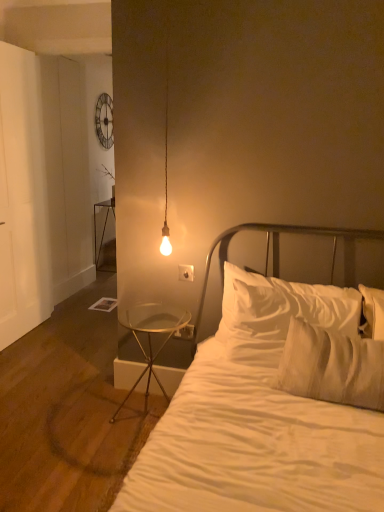
Question: Is the position of clear glass table at lower left, which ranks as the second nightstand in back-to-front order, more distant than that of white soft pillow at center?

Choices:
 (A) yes
 (B) no

Answer: (A)

Question: From the image's perspective, is clear glass table at lower left, positioned as the 1th nightstand in right-to-left order, located beneath white soft pillow at center?

Choices:
 (A) no
 (B) yes

Answer: (B)

Question: Does clear glass table at lower left, acting as the 2th nightstand starting from the left, have a greater height compared to white soft pillow at center?

Choices:
 (A) no
 (B) yes

Answer: (B)

Question: Does clear glass table at lower left, positioned as the 1th nightstand in right-to-left order, touch white soft pillow at center?

Choices:
 (A) yes
 (B) no

Answer: (B)

Question: Could you tell me if clear glass table at lower left, positioned as the 1th nightstand in right-to-left order, is facing white soft pillow at center?

Choices:
 (A) yes
 (B) no

Answer: (B)

Question: In the image, is white plastic electric outlet at lower center, which is the second electric outlet in top-to-bottom order, on the left side or the right side of clear glass table at lower left, which is the 1th nightstand from bottom to top?

Choices:
 (A) left
 (B) right

Answer: (B)

Question: Considering their positions, is white plastic electric outlet at lower center, which is the second electric outlet in top-to-bottom order, located in front of or behind clear glass table at lower left, which ranks as the second nightstand in back-to-front order?

Choices:
 (A) front
 (B) behind

Answer: (B)

Question: Is point (188, 333) positioned closer to the camera than point (144, 310)?

Choices:
 (A) farther
 (B) closer

Answer: (B)

Question: In terms of size, does white plastic electric outlet at lower center, which ranks as the 1th electric outlet in back-to-front order, appear bigger or smaller than clear glass table at lower left, the 2th nightstand from the top?

Choices:
 (A) small
 (B) big

Answer: (A)

Question: Considering their positions, is white cotton bed at center located in front of or behind white plastic electric outlet at lower center, which ranks as the 1th electric outlet in back-to-front order?

Choices:
 (A) front
 (B) behind

Answer: (A)

Question: Is white cotton bed at center wider or thinner than white plastic electric outlet at lower center, placed as the second electric outlet when sorted from front to back?

Choices:
 (A) wide
 (B) thin

Answer: (A)

Question: Is white cotton bed at center situated inside white plastic electric outlet at lower center, the 1th electric outlet ordered from the bottom, or outside?

Choices:
 (A) inside
 (B) outside

Answer: (B)

Question: From a real-world perspective, is white cotton bed at center physically located above or below white plastic electric outlet at lower center, the 1th electric outlet ordered from the bottom?

Choices:
 (A) above
 (B) below

Answer: (A)

Question: Based on their positions, is white plastic electric outlet at lower center, the 1th electric outlet ordered from the bottom, located to the left or right of metallic glass table at left, the 1th nightstand from the back?

Choices:
 (A) right
 (B) left

Answer: (A)

Question: Considering the positions of white plastic electric outlet at lower center, placed as the second electric outlet when sorted from front to back, and metallic glass table at left, the first nightstand from the left, in the image, is white plastic electric outlet at lower center, placed as the second electric outlet when sorted from front to back, taller or shorter than metallic glass table at left, the first nightstand from the left,?

Choices:
 (A) short
 (B) tall

Answer: (A)